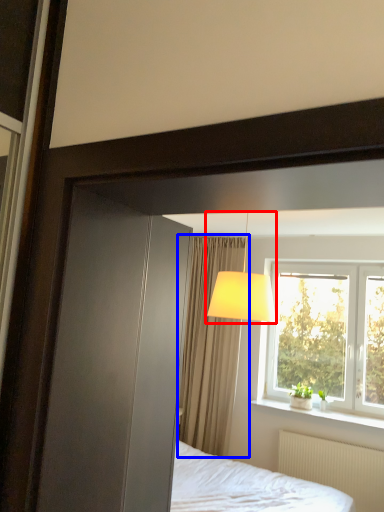
Question: Among these objects, which one is nearest to the camera, table lamp (highlighted by a red box) or curtain (highlighted by a blue box)?

Choices:
 (A) table lamp
 (B) curtain

Answer: (A)